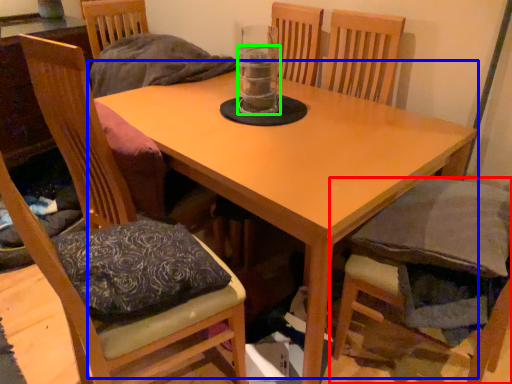
Question: Considering the real-world distances, which object is closest to chair (highlighted by a red box)? table (highlighted by a blue box) or beverage (highlighted by a green box).

Choices:
 (A) table
 (B) beverage

Answer: (A)